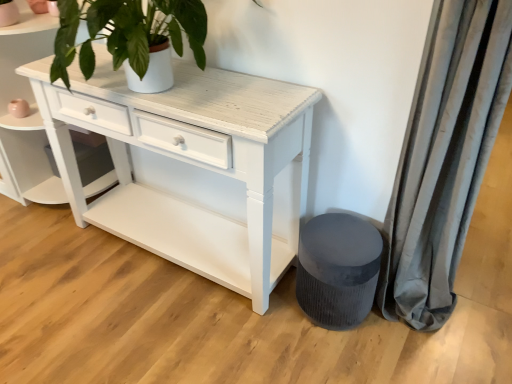
Question: Based on their positions, is gray velvet curtain at right located to the left or right of white distressed wood shelf at center?

Choices:
 (A) right
 (B) left

Answer: (A)

Question: Considering the positions of gray velvet curtain at right and white distressed wood shelf at center in the image, is gray velvet curtain at right taller or shorter than white distressed wood shelf at center?

Choices:
 (A) short
 (B) tall

Answer: (B)

Question: Estimate the real-world distances between objects in this image. Which object is farther from the white distressed wood shelf at center?

Choices:
 (A) velvet grey stool at lower right
 (B) gray velvet curtain at right

Answer: (B)

Question: Which is farther from the gray velvet curtain at right?

Choices:
 (A) velvet grey stool at lower right
 (B) white distressed wood shelf at center

Answer: (B)